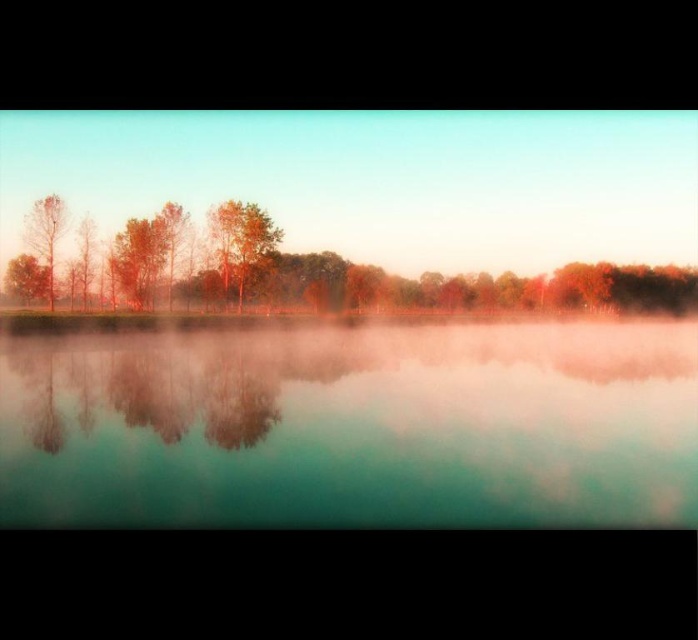
You are standing at the edge of the water and want to walk towards the smooth brown tree at left and the matte orange trees at center. Which one will you reach first?

You will reach the matte orange trees at center first because they are closer to you than the smooth brown tree at left, which is further away.

You are standing at the edge of the lake and see the translucent glass water at center and the smooth brown tree at left. Which object is shorter in height?

The translucent glass water at center is shorter in height compared to the smooth brown tree at left according to the description.